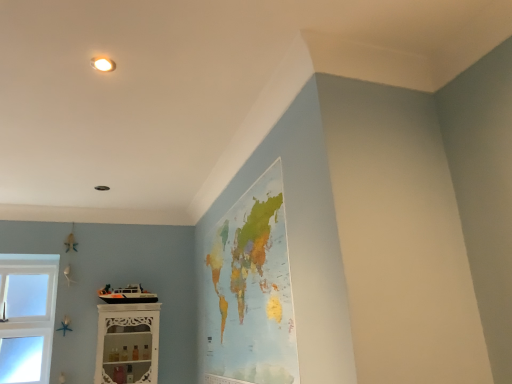
Image resolution: width=512 pixels, height=384 pixels. Describe the element at coordinates (127, 343) in the screenshot. I see `white carved wood shelf at lower left` at that location.

Identify the location of white carved wood shelf at lower left. (127, 343).

The image size is (512, 384). What do you see at coordinates (250, 291) in the screenshot? I see `watercolor paper map at upper center` at bounding box center [250, 291].

Find the location of a particular element. The image size is (512, 384). watercolor paper map at upper center is located at coordinates (250, 291).

Locate an element on the screen. The height and width of the screenshot is (384, 512). white carved wood shelf at lower left is located at coordinates (127, 343).

In the scene shown: Between watercolor paper map at upper center and white carved wood shelf at lower left, which one appears on the left side from the viewer's perspective?

white carved wood shelf at lower left is more to the left.

Which object is closer to the camera taking this photo, watercolor paper map at upper center or white carved wood shelf at lower left?

watercolor paper map at upper center is closer to the camera.

Which point is more forward, (252, 255) or (124, 341)?

Positioned in front is point (252, 255).

From the image's perspective, is watercolor paper map at upper center above or below white carved wood shelf at lower left?

Based on their image positions, watercolor paper map at upper center is located above white carved wood shelf at lower left.

From a real-world perspective, which is physically below, watercolor paper map at upper center or white carved wood shelf at lower left?

white carved wood shelf at lower left is physically lower.

Is watercolor paper map at upper center thinner than white carved wood shelf at lower left?

Indeed, watercolor paper map at upper center has a lesser width compared to white carved wood shelf at lower left.

Consider the image. Does watercolor paper map at upper center have a lesser height compared to white carved wood shelf at lower left?

No.

Which of these two, watercolor paper map at upper center or white carved wood shelf at lower left, is smaller?

white carved wood shelf at lower left is smaller.

Is white carved wood shelf at lower left completely or partially inside watercolor paper map at upper center?

No, white carved wood shelf at lower left is not surrounded by watercolor paper map at upper center.

Is the surface of watercolor paper map at upper center in direct contact with white carved wood shelf at lower left?

No.

Is watercolor paper map at upper center facing towards white carved wood shelf at lower left?

Yes, watercolor paper map at upper center is oriented towards white carved wood shelf at lower left.

How different are the orientations of watercolor paper map at upper center and white carved wood shelf at lower left in degrees?

There is a 90.9-degree angle between the facing directions of watercolor paper map at upper center and white carved wood shelf at lower left.

Where is `map that is above the white carved wood shelf at lower left (from the image's perspective)`? The width and height of the screenshot is (512, 384). map that is above the white carved wood shelf at lower left (from the image's perspective) is located at coordinates (250, 291).

Is white carved wood shelf at lower left to the left of watercolor paper map at upper center from the viewer's perspective?

Correct, you'll find white carved wood shelf at lower left to the left of watercolor paper map at upper center.

Which object is more forward, white carved wood shelf at lower left or watercolor paper map at upper center?

watercolor paper map at upper center is in front.

Which is behind, point (102, 334) or point (283, 311)?

The point (102, 334) is more distant.

From the image's perspective, which is above, white carved wood shelf at lower left or watercolor paper map at upper center?

watercolor paper map at upper center is shown above in the image.

From a real-world perspective, is white carved wood shelf at lower left positioned over watercolor paper map at upper center based on gravity?

No, from a real-world perspective, white carved wood shelf at lower left is not over watercolor paper map at upper center

Does white carved wood shelf at lower left have a lesser width compared to watercolor paper map at upper center?

No, white carved wood shelf at lower left is not thinner than watercolor paper map at upper center.

Considering the sizes of objects white carved wood shelf at lower left and watercolor paper map at upper center in the image provided, who is shorter, white carved wood shelf at lower left or watercolor paper map at upper center?

With less height is white carved wood shelf at lower left.

Is white carved wood shelf at lower left smaller than watercolor paper map at upper center?

Indeed, white carved wood shelf at lower left has a smaller size compared to watercolor paper map at upper center.

Can watercolor paper map at upper center be found inside white carved wood shelf at lower left?

No, watercolor paper map at upper center is located outside of white carved wood shelf at lower left.

Is white carved wood shelf at lower left next to watercolor paper map at upper center?

No, white carved wood shelf at lower left is not touching watercolor paper map at upper center.

Is white carved wood shelf at lower left facing away from watercolor paper map at upper center?

white carved wood shelf at lower left is not turned away from watercolor paper map at upper center.

Identify the location of map located in front of the white carved wood shelf at lower left. The width and height of the screenshot is (512, 384). (250, 291).

What are the coordinates of `map lying in front of the white carved wood shelf at lower left` in the screenshot? It's located at pos(250,291).

Identify the location of shelf below the watercolor paper map at upper center (from a real-world perspective). Image resolution: width=512 pixels, height=384 pixels. (127, 343).